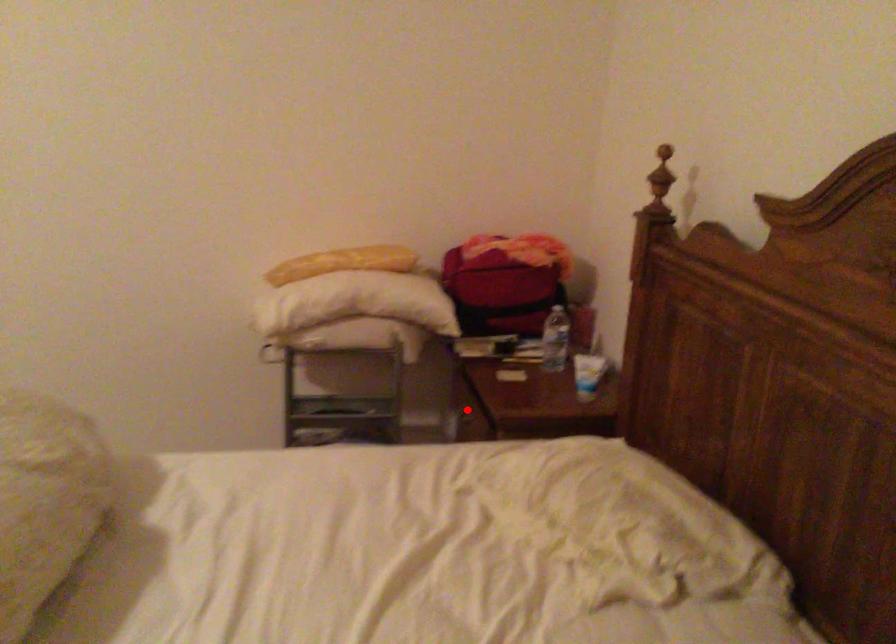
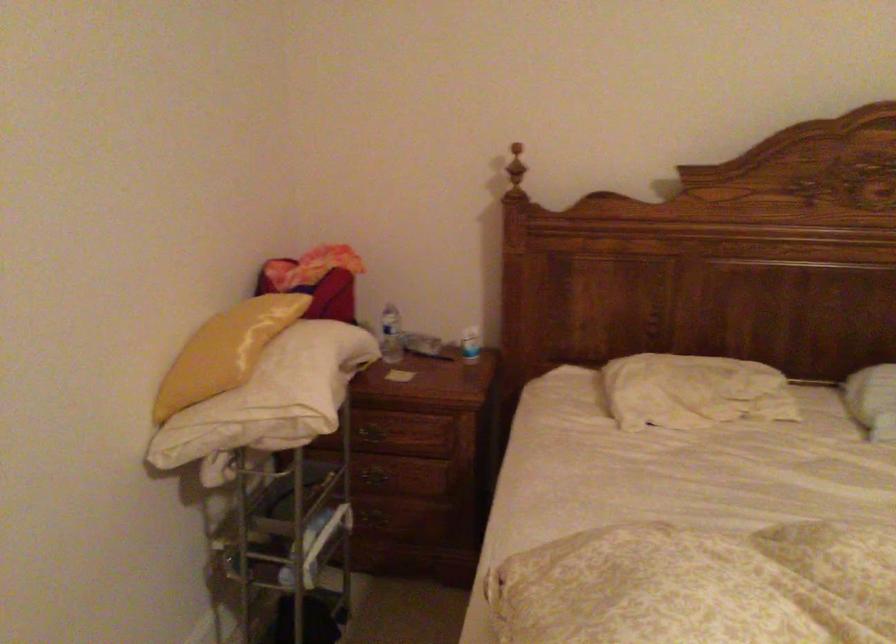
Where in the second image is the point corresponding to the highlighted location from the first image?

(374, 430)